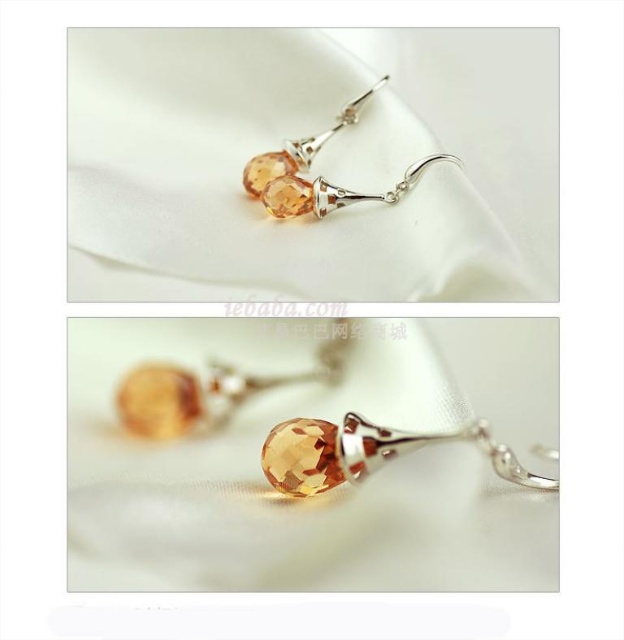
You are an appraiser examining two earrings. You notice both have a citrine crystal drop at center and a citrine glass drop at center. Which one is positioned closer to you?

The citrine crystal drop at center is positioned closer to you as it is in front of the citrine glass drop at center.

Consider the image. You are a jeweler examining two earrings displayed on a white fabric. The first earring has a citrine crystal drop at center, and the second has a citrine glass drop at center. Which of these two drops has a greater width?

The citrine crystal drop at center has a greater width than the citrine glass drop at center.